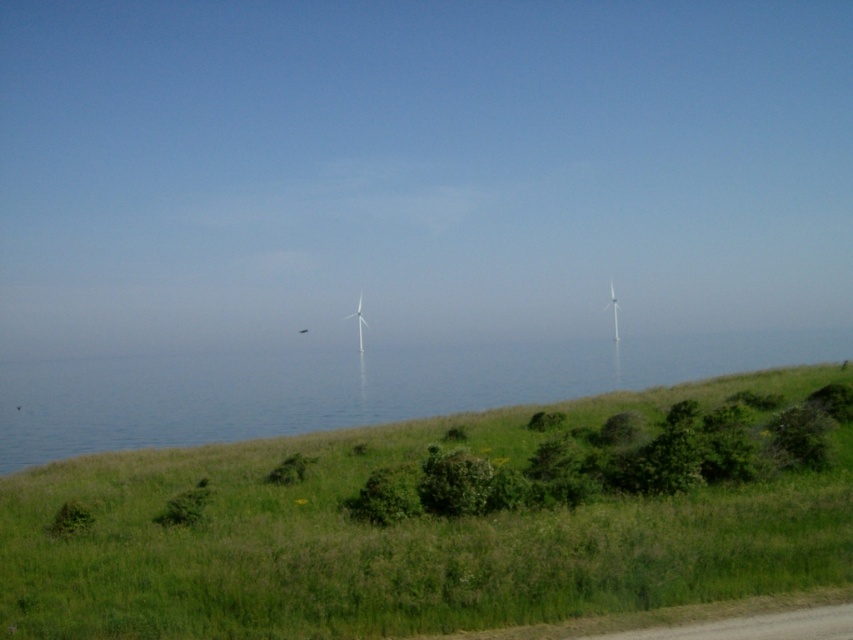
Question: Is blue water at center closer to camera compared to white plastic wind turbine at center?

Choices:
 (A) yes
 (B) no

Answer: (A)

Question: Which point is closer to the camera taking this photo?

Choices:
 (A) (361, 346)
 (B) (259, 380)
 (C) (618, 324)

Answer: (B)

Question: Which of the following is the farthest from the observer?

Choices:
 (A) (177, 365)
 (B) (706, 424)

Answer: (A)

Question: Is green grassy hillside at lower center behind blue water at center?

Choices:
 (A) yes
 (B) no

Answer: (B)

Question: Which of the following is the closest to the observer?

Choices:
 (A) (683, 365)
 (B) (618, 310)
 (C) (363, 340)
 (D) (195, 564)

Answer: (D)

Question: Is white matte wind turbine at center bigger than white plastic wind turbine at center?

Choices:
 (A) yes
 (B) no

Answer: (B)